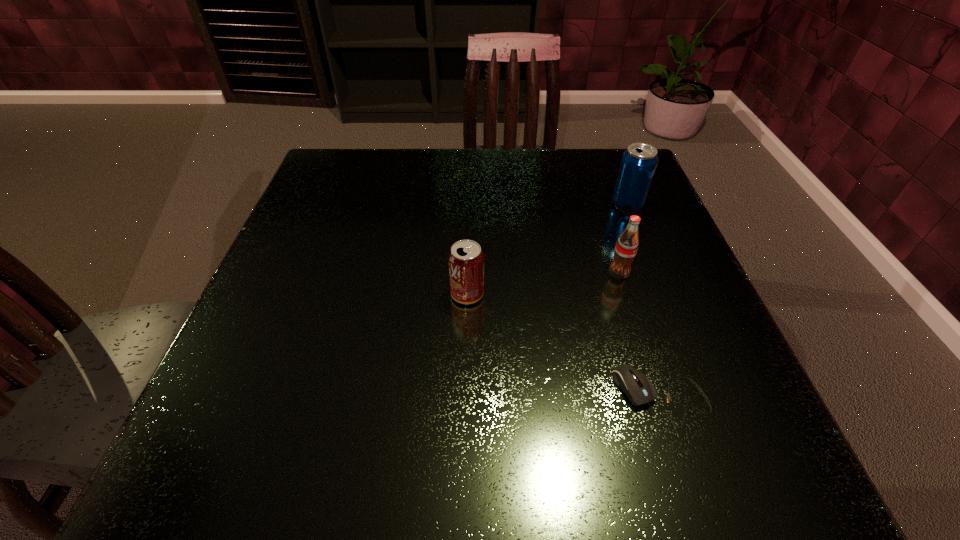
What are the coordinates of `vacant space at the right edge` in the screenshot? It's located at (x=667, y=255).

This screenshot has height=540, width=960. Identify the location of free region at the far right corner. (589, 167).

This screenshot has height=540, width=960. What are the coordinates of `free space at the near right corner` in the screenshot? It's located at (686, 430).

Locate an element on the screen. This screenshot has width=960, height=540. free space between the farthest object and the shortest object is located at coordinates (644, 300).

Locate an element on the screen. The image size is (960, 540). free space between the shortest soda can and the computer mouse is located at coordinates (564, 345).

Identify the location of free space between the rightmost soda can and the third farthest object. The width and height of the screenshot is (960, 540). (547, 249).

Where is `free space between the rightmost soda can and the leftmost object`? Image resolution: width=960 pixels, height=540 pixels. free space between the rightmost soda can and the leftmost object is located at coordinates (547, 249).

Identify the location of free point between the second nearest soda can and the leftmost soda can. This screenshot has height=540, width=960. (543, 284).

Find the location of a particular element. The height and width of the screenshot is (540, 960). empty space between the nearest object and the nearest soda can is located at coordinates (564, 345).

Find the location of a particular element. empty space between the second farthest soda can and the second shortest object is located at coordinates (543, 284).